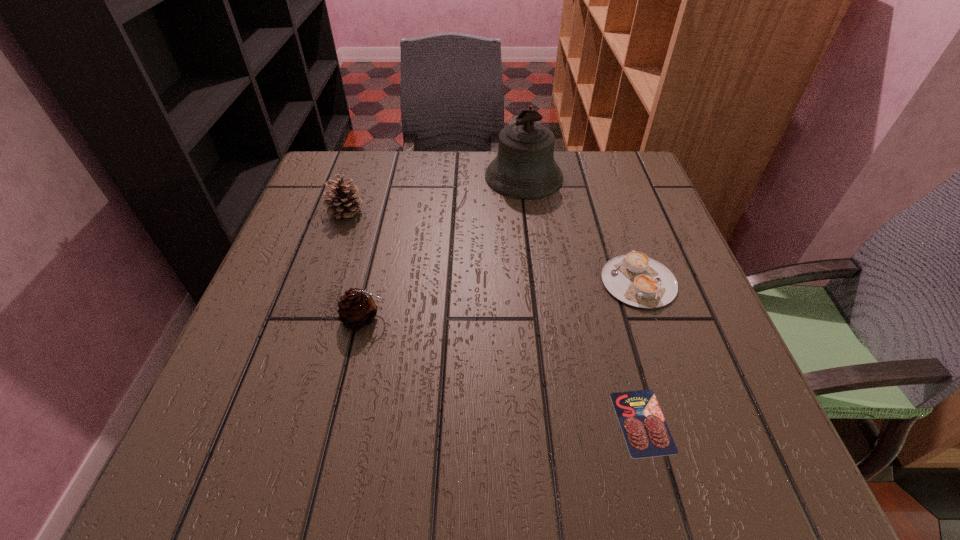
You are a GUI agent. You are given a task and a screenshot of the screen. Output one action in this format:
    pyautogui.click(x=<x>, y=<y>)
    Task: Click on the farthest object
    This screenshot has height=540, width=960.
    Given the screenshot: What is the action you would take?
    pyautogui.click(x=524, y=168)

Identify the location of the tallest object. (524, 168).

Identify the location of the taller pinecone. (341, 203).

The height and width of the screenshot is (540, 960). Find the location of `the second farthest object`. the second farthest object is located at coordinates (341, 203).

Where is `the shorter pinecone`? The height and width of the screenshot is (540, 960). the shorter pinecone is located at coordinates (357, 309).

Image resolution: width=960 pixels, height=540 pixels. Find the location of `the nearer pinecone`. the nearer pinecone is located at coordinates (357, 309).

Where is `cappuccino`? cappuccino is located at coordinates (635, 279).

Where is `the nearest object`? the nearest object is located at coordinates (646, 433).

Find the location of a particular element. Image resolution: width=960 pixels, height=540 pixels. the shortest object is located at coordinates (646, 433).

The image size is (960, 540). In order to click on free space located 0.100m on the right of the bell in this screenshot , I will do `click(602, 177)`.